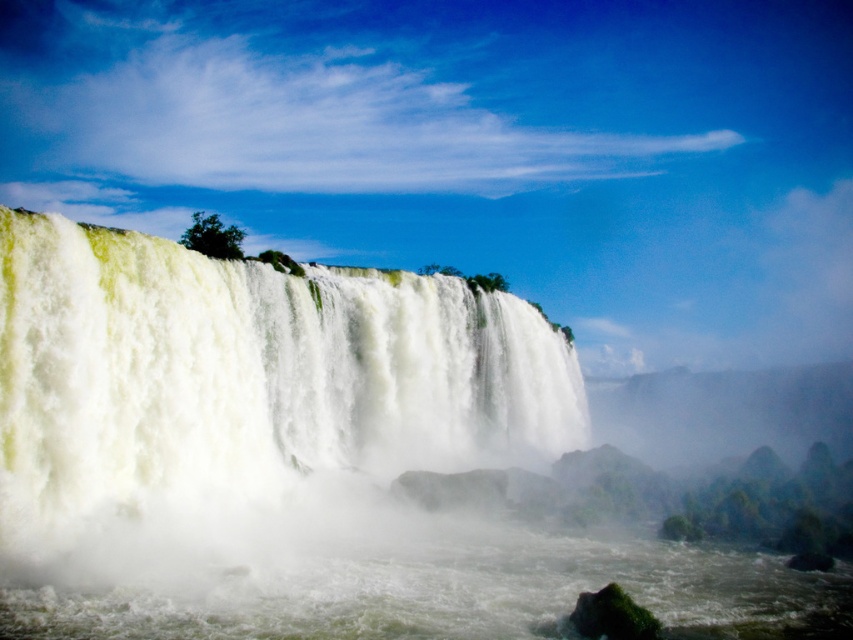
You are a drone operator trying to capture the waterfall. Your drone is currently at the point labeled point (244, 401). Based on the scene description, what type of terrain is your drone hovering over?

The point (244, 401) is on white foamy water at center, so the drone is hovering over white foamy water.

Based on the photo, you are a photographer planning to capture the waterfall and river scene. You need to decide which area has a narrower width for your composition. Based on the scene, which between the white foamy water at center and the white frothy water at lower center should you focus on?

The white foamy water at center has a narrower width compared to the white frothy water at lower center, so focusing on the white foamy water at center would be better for capturing a narrower area in your composition.